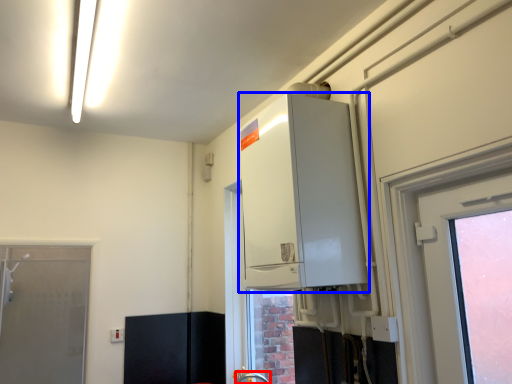
Question: Which of the following is the farthest to the observer, faucet (highlighted by a red box) or appliance (highlighted by a blue box)?

Choices:
 (A) faucet
 (B) appliance

Answer: (A)